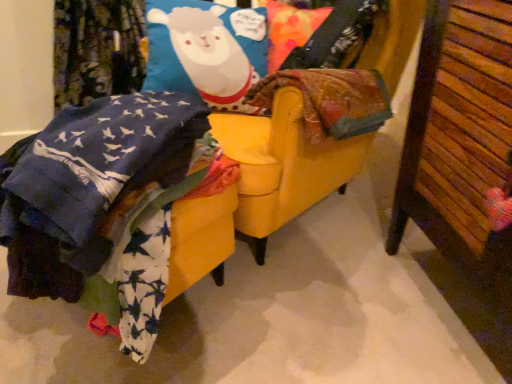
Measure the distance between point (260, 259) and camera.

Point (260, 259) and camera are 1.45 meters apart.

The width and height of the screenshot is (512, 384). I want to click on yellow fabric swivel chair at center, so click(x=285, y=170).

What do you see at coordinates (285, 170) in the screenshot? The height and width of the screenshot is (384, 512). I see `yellow fabric swivel chair at center` at bounding box center [285, 170].

What is the approximate height of wooden slats at right?

It is 33.97 inches.

What do you see at coordinates (462, 156) in the screenshot? I see `wooden slats at right` at bounding box center [462, 156].

Measure the distance between point (497, 110) and camera.

Point (497, 110) and camera are 34.25 inches apart.

Find the location of a particular element. Image resolution: width=512 pixels, height=384 pixels. wooden slats at right is located at coordinates (462, 156).

This screenshot has height=384, width=512. Identify the location of yellow fabric swivel chair at center. (285, 170).

Is yellow fabric swivel chair at center to the left of wooden slats at right from the viewer's perspective?

Result: Yes, yellow fabric swivel chair at center is to the left of wooden slats at right.

Does yellow fabric swivel chair at center lie in front of wooden slats at right?

No, yellow fabric swivel chair at center is behind wooden slats at right.

Between point (265, 122) and point (430, 153), which one is positioned behind?

Positioned behind is point (265, 122).

From the image's perspective, which one is positioned higher, yellow fabric swivel chair at center or wooden slats at right?

yellow fabric swivel chair at center, from the image's perspective.

In the scene shown: From a real-world perspective, who is located lower, yellow fabric swivel chair at center or wooden slats at right?

yellow fabric swivel chair at center, from a real-world perspective.

Between yellow fabric swivel chair at center and wooden slats at right, which one has smaller width?

wooden slats at right is thinner.

Based on the photo, considering the relative sizes of yellow fabric swivel chair at center and wooden slats at right in the image provided, is yellow fabric swivel chair at center shorter than wooden slats at right?

No.

Considering the sizes of objects yellow fabric swivel chair at center and wooden slats at right in the image provided, who is smaller, yellow fabric swivel chair at center or wooden slats at right?

Smaller between the two is wooden slats at right.

Is yellow fabric swivel chair at center not inside wooden slats at right?

Indeed, yellow fabric swivel chair at center is completely outside wooden slats at right.

Would you consider yellow fabric swivel chair at center to be distant from wooden slats at right?

They are positioned close to each other.

Is yellow fabric swivel chair at center turned away from wooden slats at right?

No, yellow fabric swivel chair at center is not facing away from wooden slats at right.

How many degrees apart are the facing directions of yellow fabric swivel chair at center and wooden slats at right?

35.2 degrees.

Measure the distance from yellow fabric swivel chair at center to wooden slats at right.

15.86 inches.

Image resolution: width=512 pixels, height=384 pixels. Identify the location of furniture that is below the yellow fabric swivel chair at center (from the image's perspective). (462, 156).

In the image, is wooden slats at right on the left side or the right side of yellow fabric swivel chair at center?

wooden slats at right is to the right of yellow fabric swivel chair at center.

Does wooden slats at right come in front of yellow fabric swivel chair at center?

Yes, the depth of wooden slats at right is less than that of yellow fabric swivel chair at center.

Which is in front, point (473, 63) or point (264, 214)?

The point (473, 63) is in front.

From the image's perspective, is wooden slats at right located above or below yellow fabric swivel chair at center?

From the image's perspective, wooden slats at right appears below yellow fabric swivel chair at center.

From a real-world perspective, is wooden slats at right positioned over yellow fabric swivel chair at center based on gravity?

Indeed, from a real-world perspective, wooden slats at right stands above yellow fabric swivel chair at center.

Can you confirm if wooden slats at right is thinner than yellow fabric swivel chair at center?

Yes.

Is wooden slats at right taller or shorter than yellow fabric swivel chair at center?

In the image, wooden slats at right appears to be shorter than yellow fabric swivel chair at center.

In the scene shown: Considering the relative sizes of wooden slats at right and yellow fabric swivel chair at center in the image provided, is wooden slats at right smaller than yellow fabric swivel chair at center?

Indeed, wooden slats at right has a smaller size compared to yellow fabric swivel chair at center.

Is wooden slats at right completely or partially outside of yellow fabric swivel chair at center?

wooden slats at right is positioned outside yellow fabric swivel chair at center.

Is wooden slats at right not near yellow fabric swivel chair at center?

That's not correct — wooden slats at right is a little close to yellow fabric swivel chair at center.

Is wooden slats at right oriented towards yellow fabric swivel chair at center?

No.

How different are the orientations of wooden slats at right and yellow fabric swivel chair at center in degrees?

35.2 degrees.

You are a GUI agent. You are given a task and a screenshot of the screen. Output one action in this format:
    pyautogui.click(x=<x>, y=<y>)
    Task: Click on the swivel chair on the left of wooden slats at right
    This screenshot has width=512, height=384.
    Given the screenshot: What is the action you would take?
    pyautogui.click(x=285, y=170)

Find the location of `furniture in front of the yellow fabric swivel chair at center`. furniture in front of the yellow fabric swivel chair at center is located at coordinates (462, 156).

You are a GUI agent. You are given a task and a screenshot of the screen. Output one action in this format:
    pyautogui.click(x=<x>, y=<y>)
    Task: Click on the furniture that appears on the right of yellow fabric swivel chair at center
    
    Given the screenshot: What is the action you would take?
    pyautogui.click(x=462, y=156)